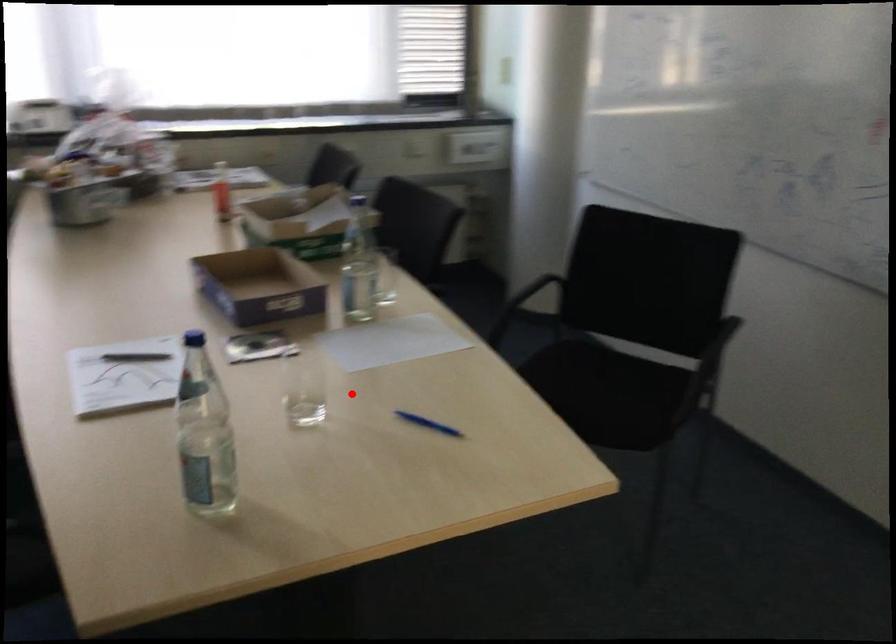
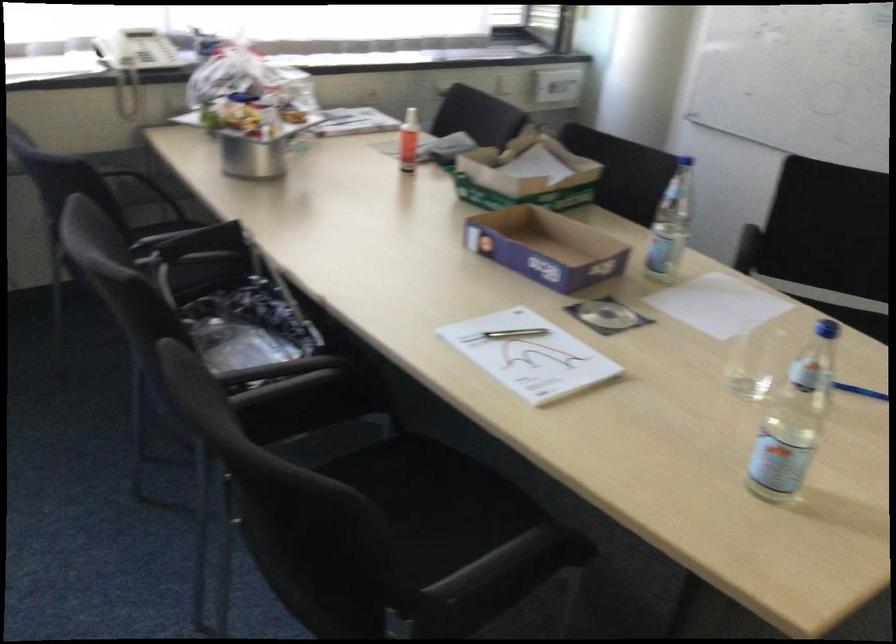
Locate, in the second image, the point that corresponds to the highlighted location in the first image.

(754, 362)